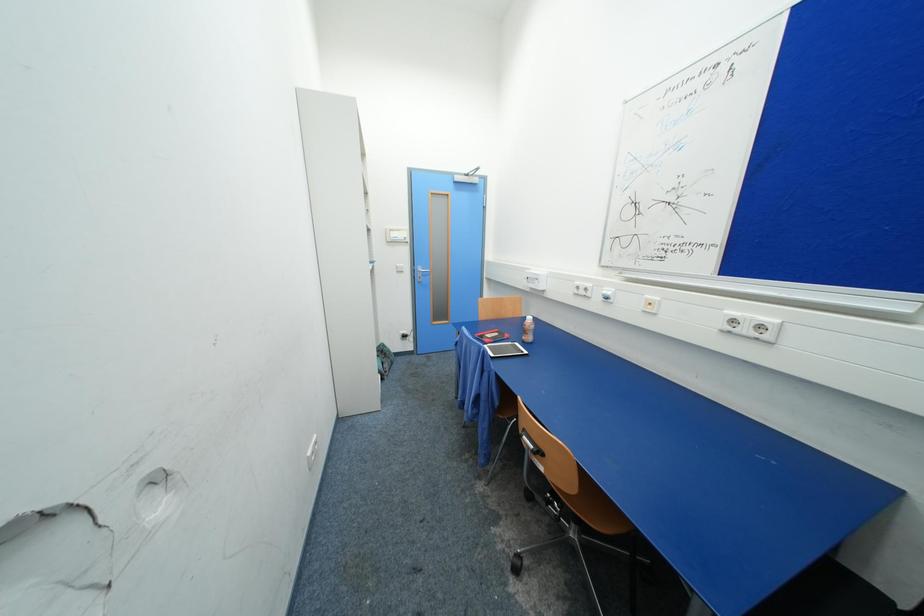
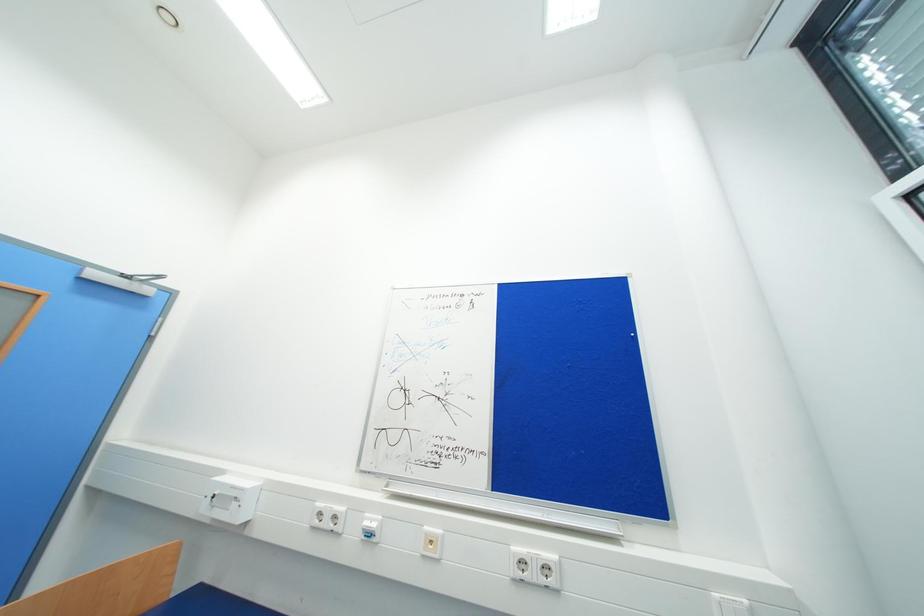
How did the camera likely rotate?

The camera's rotation is toward right-up.